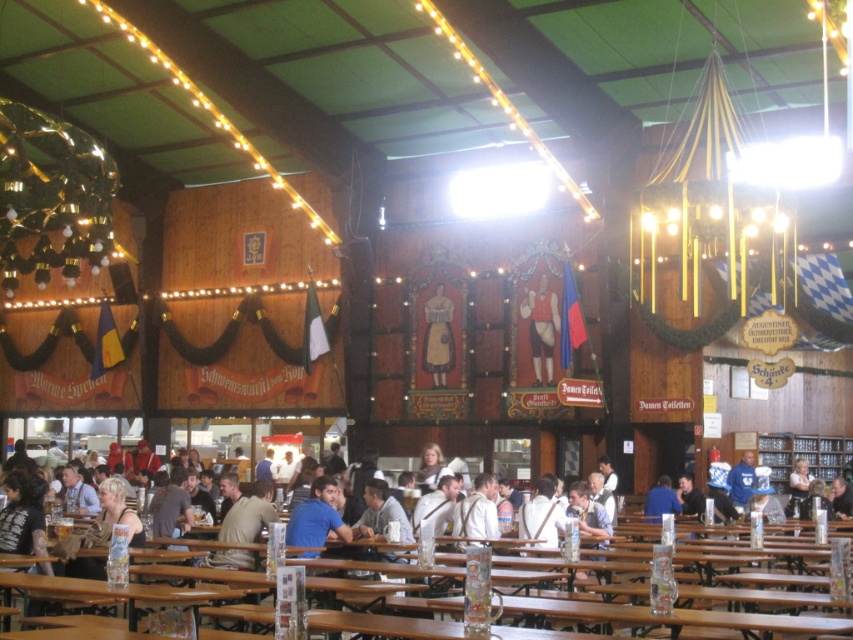
You are a guest at the Oktoberfest beer hall and want to see the golden spherical ornament on the left side of the ceiling. You are standing in front of the wooden figure at center and the light brown leather jacket at center. Which object should you move around to get a better view of the ornament?

To see the golden spherical ornament on the left side, you should move around the light brown leather jacket at center because it is behind the wooden figure at center, blocking the view.

From the picture: You are standing in the beer hall and notice two points marked on the wall. The first point is at coordinates point (434, 333) and the second is at point (432, 468). Which point is closer to you?

Point (434, 333) is further to the camera than point (432, 468), so the point closer to you is point (432, 468).